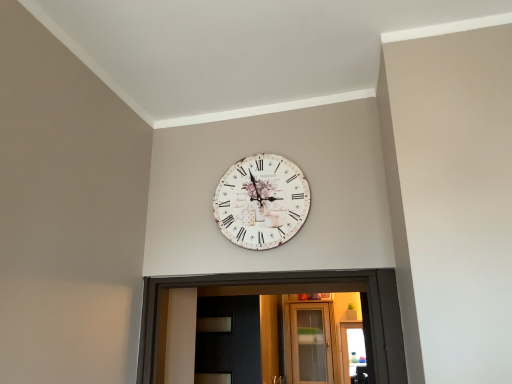
Question: Is clear glass door at center in front of or behind vintage paper clock at center in the image?

Choices:
 (A) behind
 (B) front

Answer: (A)

Question: Based on their sizes in the image, would you say clear glass door at center is bigger or smaller than vintage paper clock at center?

Choices:
 (A) small
 (B) big

Answer: (B)

Question: From the image's perspective, is clear glass door at center above or below vintage paper clock at center?

Choices:
 (A) above
 (B) below

Answer: (B)

Question: Looking at their shapes, would you say vintage paper clock at center is wider or thinner than clear glass door at center?

Choices:
 (A) thin
 (B) wide

Answer: (A)

Question: Is vintage paper clock at center bigger or smaller than clear glass door at center?

Choices:
 (A) small
 (B) big

Answer: (A)

Question: From the image's perspective, relative to clear glass door at center, is vintage paper clock at center above or below?

Choices:
 (A) above
 (B) below

Answer: (A)

Question: Is vintage paper clock at center taller or shorter than clear glass door at center?

Choices:
 (A) short
 (B) tall

Answer: (A)